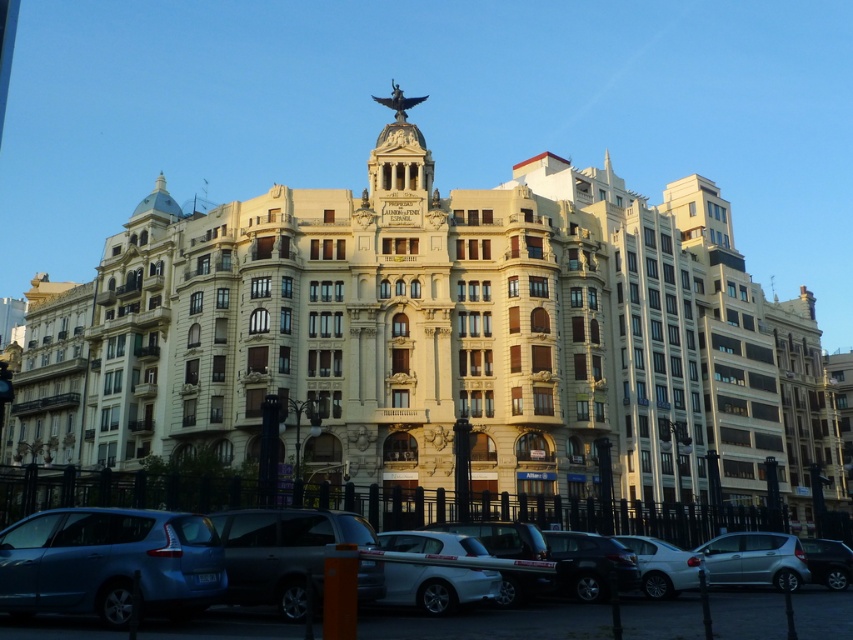
You are standing in front of the grand building and notice two points marked on the facade. The first point is at coordinates point (614, 552) and the second is at point (634, 547). Which of these two points is closer to your current position?

Point (614, 552) is closer to the camera than point (634, 547), so the first point is closer to your current position.

You are a pedestrian standing on the sidewalk outside the grand building. You see the shiny black car at lower center and the white glossy sedan at center. Which car is nearer to you?

The shiny black car at lower center is closer to the viewer than the white glossy sedan at center, so the shiny black car at lower center is nearer to you.